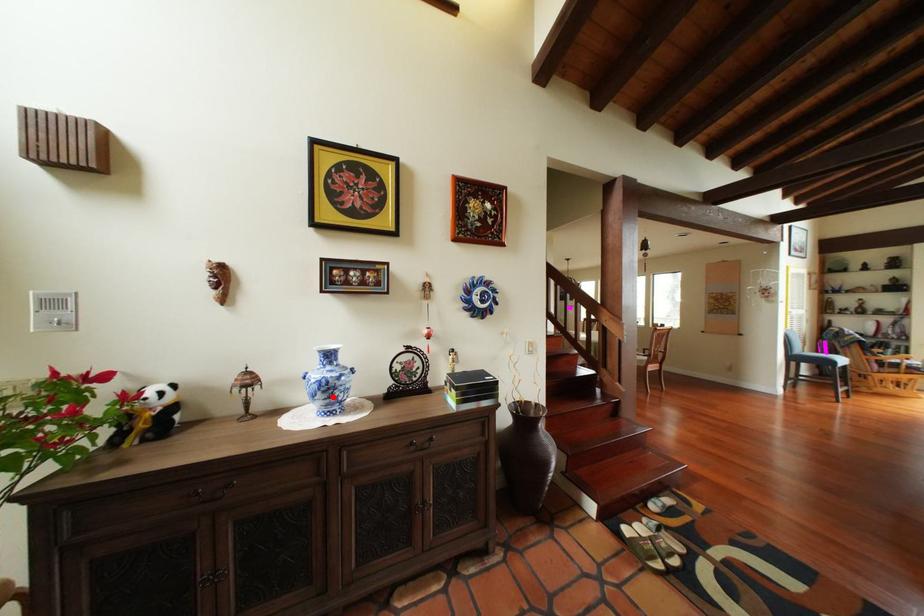
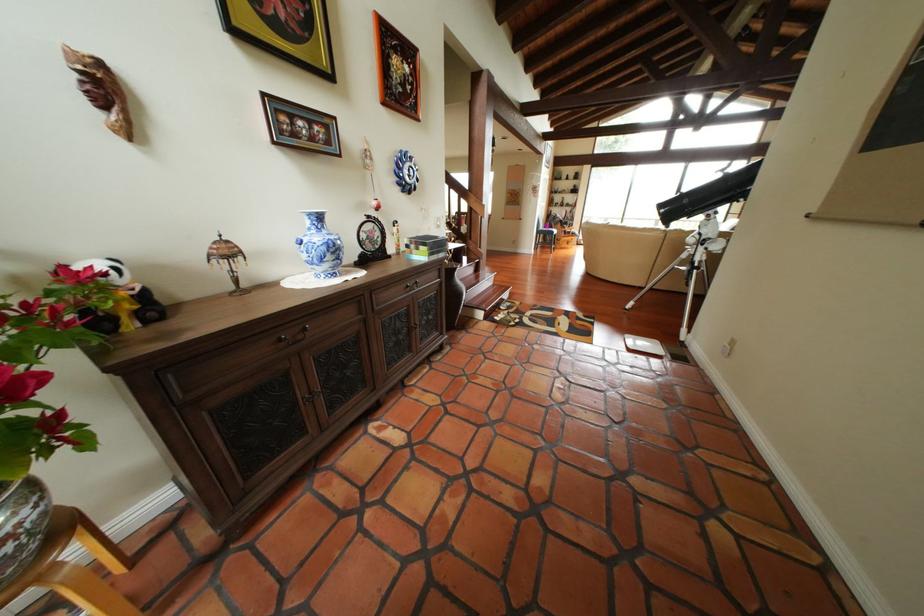
Question: A red point is marked in image1. In image2, is the corresponding 3D point closer to the camera or farther? Reply with the corresponding letter.

Choices:
 (A) The corresponding 3D point is closer.
 (B) The corresponding 3D point is farther.

Answer: (A)